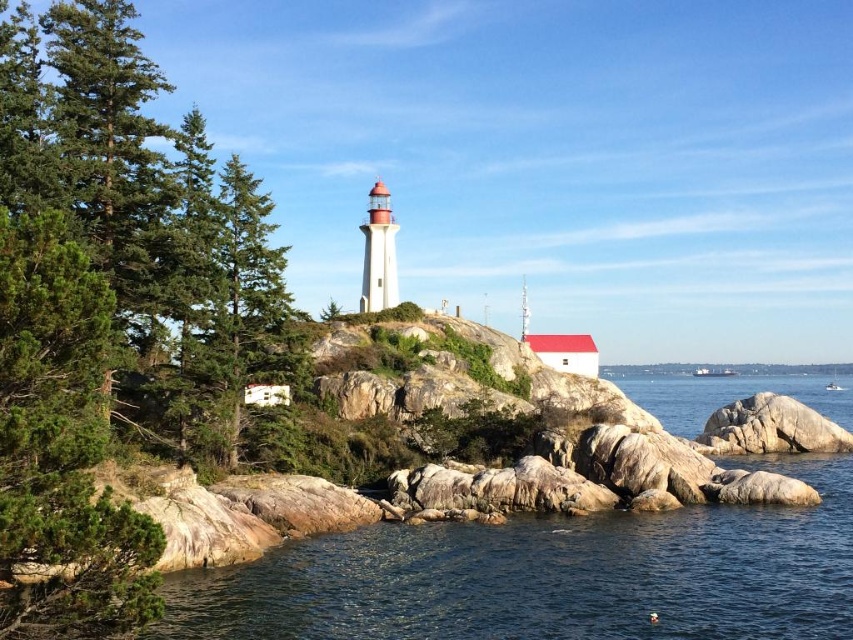
Question: Does green matte tree at upper left have a lesser width compared to clear water at lower left?

Choices:
 (A) no
 (B) yes

Answer: (B)

Question: Which point is closer to the camera?

Choices:
 (A) clear water at lower left
 (B) green matte tree at upper left

Answer: (B)

Question: Is green matte tree at upper left positioned behind gray rock at lower right?

Choices:
 (A) yes
 (B) no

Answer: (B)

Question: Which object is the farthest from the gray rock at lower right?

Choices:
 (A) green matte tree at upper left
 (B) clear water at lower left

Answer: (A)

Question: Does green matte tree at upper left appear on the left side of gray rock at lower right?

Choices:
 (A) yes
 (B) no

Answer: (A)

Question: Estimate the real-world distances between objects in this image. Which object is farther from the green matte tree at upper left?

Choices:
 (A) gray rock at lower right
 (B) clear water at lower left

Answer: (A)